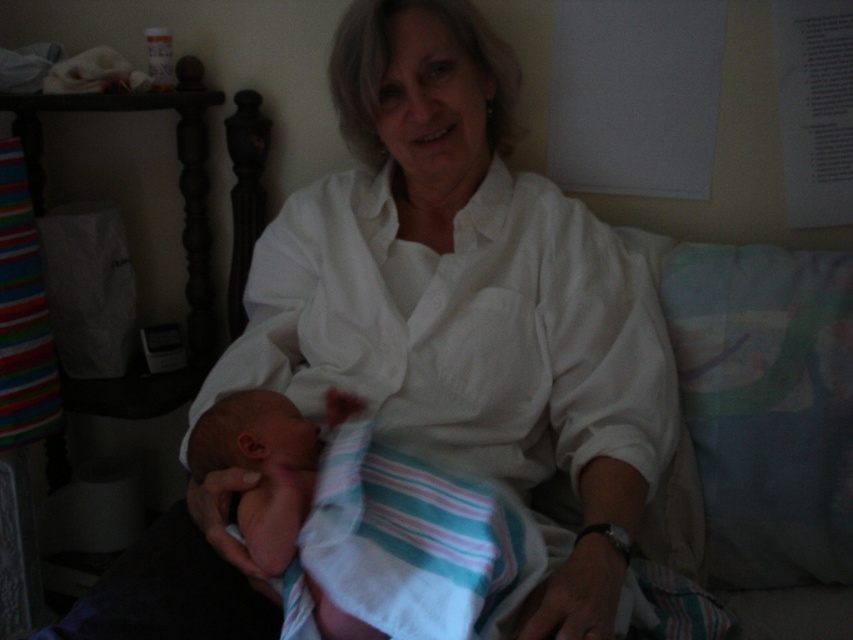
Who is lower down, white cotton shirt at center or soft white swaddle at center?

Positioned lower is soft white swaddle at center.

Between white cotton shirt at center and soft white swaddle at center, which one appears on the left side from the viewer's perspective?

From the viewer's perspective, soft white swaddle at center appears more on the left side.

Is point (305, 362) behind point (325, 404)?

That is True.

Locate an element on the screen. Image resolution: width=853 pixels, height=640 pixels. white cotton shirt at center is located at coordinates click(465, 298).